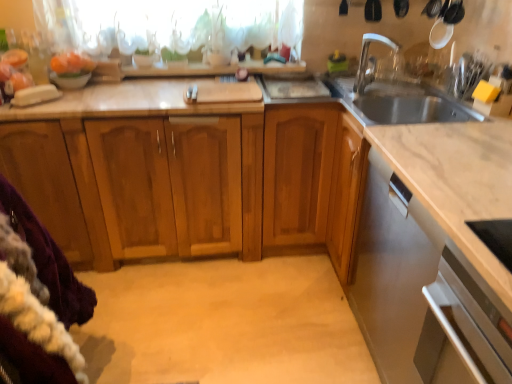
Question: Can you confirm if purple fleece blanket at lower left is positioned to the left of white glossy bowl at upper left?

Choices:
 (A) no
 (B) yes

Answer: (A)

Question: Considering the relative sizes of purple fleece blanket at lower left and white glossy bowl at upper left in the image provided, is purple fleece blanket at lower left wider than white glossy bowl at upper left?

Choices:
 (A) no
 (B) yes

Answer: (B)

Question: Does purple fleece blanket at lower left have a lesser height compared to white glossy bowl at upper left?

Choices:
 (A) no
 (B) yes

Answer: (A)

Question: Is white glossy bowl at upper left at the back of purple fleece blanket at lower left?

Choices:
 (A) no
 (B) yes

Answer: (A)

Question: Would you consider purple fleece blanket at lower left to be distant from white glossy bowl at upper left?

Choices:
 (A) yes
 (B) no

Answer: (A)

Question: Can white glossy bowl at upper left be found inside purple fleece blanket at lower left?

Choices:
 (A) no
 (B) yes

Answer: (A)

Question: Considering the relative sizes of wooden cabinets at center and satin silver oven at lower right in the image provided, is wooden cabinets at center taller than satin silver oven at lower right?

Choices:
 (A) yes
 (B) no

Answer: (A)

Question: Is wooden cabinets at center further to camera compared to satin silver oven at lower right?

Choices:
 (A) yes
 (B) no

Answer: (A)

Question: Can you confirm if wooden cabinets at center is shorter than satin silver oven at lower right?

Choices:
 (A) no
 (B) yes

Answer: (A)

Question: Is wooden cabinets at center surrounding satin silver oven at lower right?

Choices:
 (A) no
 (B) yes

Answer: (A)

Question: Does wooden cabinets at center appear on the right side of satin silver oven at lower right?

Choices:
 (A) no
 (B) yes

Answer: (A)

Question: Would you say wooden cabinets at center is outside satin silver oven at lower right?

Choices:
 (A) no
 (B) yes

Answer: (B)

Question: Does satin silver dishwasher at lower right have a greater height compared to white glossy faucet at upper right?

Choices:
 (A) no
 (B) yes

Answer: (B)